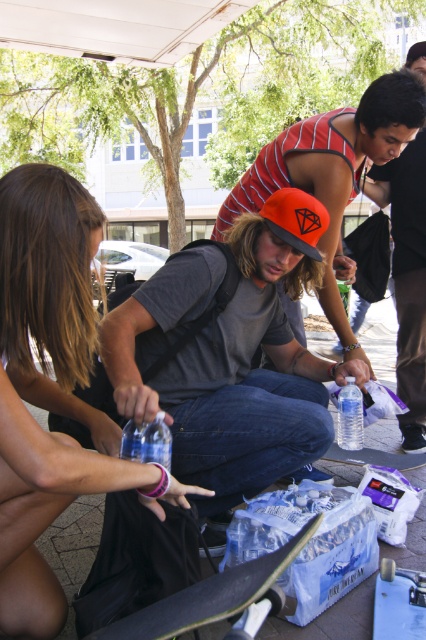
Question: Which point is closer to the camera taking this photo?

Choices:
 (A) (397, 627)
 (B) (178, 621)
 (C) (400, 323)

Answer: (B)

Question: From the image, what is the correct spatial relationship of orange fabric cap at center in relation to black matte skateboard at lower center?

Choices:
 (A) below
 (B) above

Answer: (B)

Question: Does matte black hair at left appear on the left side of orange fabric cap at center?

Choices:
 (A) yes
 (B) no

Answer: (A)

Question: Which point is closer to the camera taking this photo?

Choices:
 (A) [351, 396]
 (B) [169, 296]
 (C) [394, 612]

Answer: (C)

Question: Which of the following is the farthest from the observer?

Choices:
 (A) (351, 387)
 (B) (247, 481)
 (C) (386, 193)
 (D) (422, 465)

Answer: (C)

Question: Does black matte skateboard at lower center appear under smooth black skateboard at center?

Choices:
 (A) yes
 (B) no

Answer: (B)